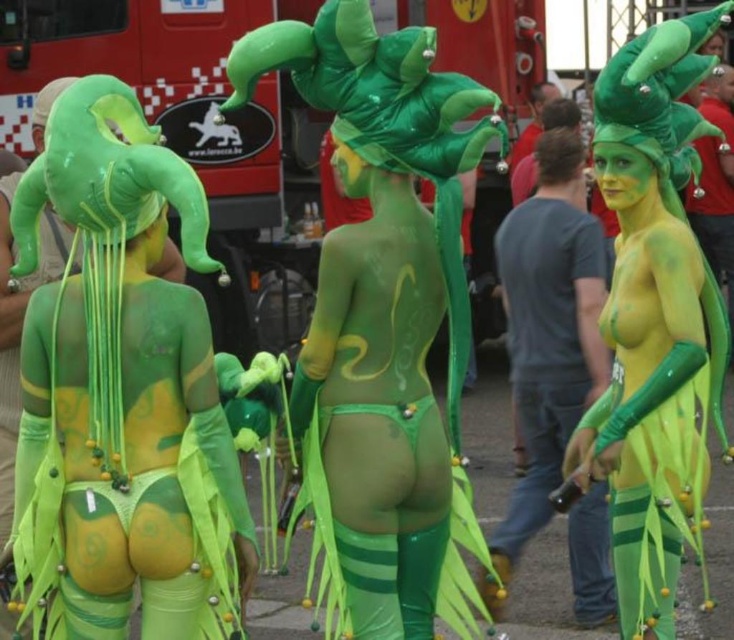
You are a photographer trying to capture the metallic red fire truck at upper left and the green matte body paint at center in a single shot. Which object should you focus on first to ensure both are in frame?

The metallic red fire truck at upper left is not as tall as the green matte body paint at center, so you should focus on the taller green matte body paint at center first to ensure both fit within the frame.